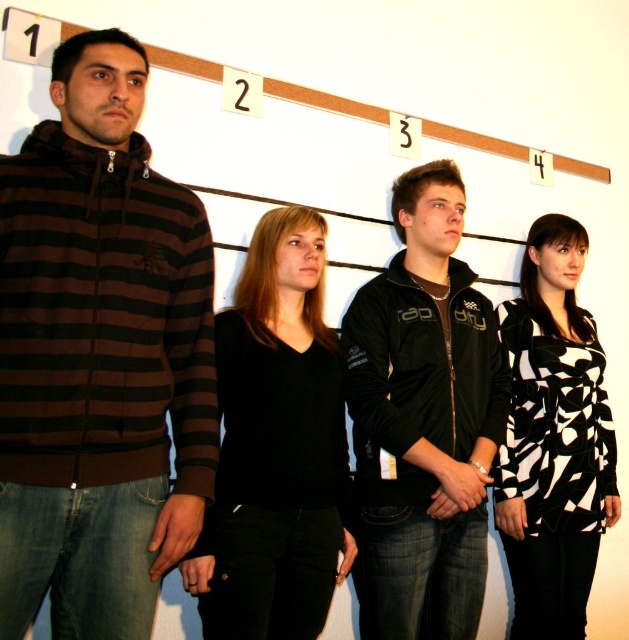
Is black matte jacket at center positioned in front of black matte sweater at center?

No.

Does black matte jacket at center appear on the right side of black matte sweater at center?

Yes, black matte jacket at center is to the right of black matte sweater at center.

Where is `black matte jacket at center`? The image size is (629, 640). black matte jacket at center is located at coordinates (423, 420).

Does brown striped hoodie at left have a lesser height compared to black and white printed dress at center?

Yes.

Is brown striped hoodie at left above black and white printed dress at center?

Correct, brown striped hoodie at left is located above black and white printed dress at center.

Identify the location of brown striped hoodie at left. This screenshot has height=640, width=629. (99, 356).

Does brown striped hoodie at left have a greater width compared to black matte sweater at center?

Indeed, brown striped hoodie at left has a greater width compared to black matte sweater at center.

Which is behind, point (208, 492) or point (226, 634)?

The point (226, 634) is behind.

Does point (67, 404) come closer to viewer compared to point (264, 241)?

That is True.

Where is `brown striped hoodie at left`? brown striped hoodie at left is located at coordinates click(x=99, y=356).